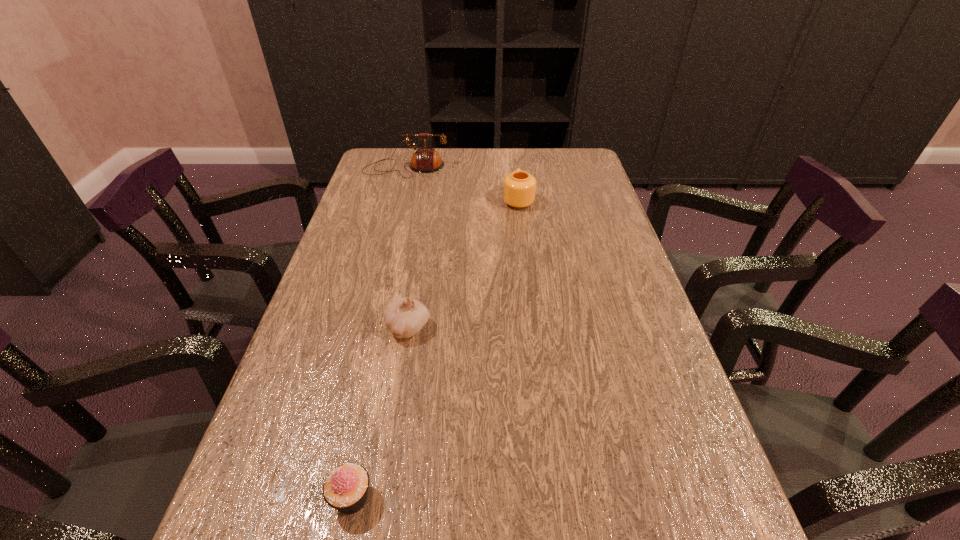
This screenshot has height=540, width=960. I want to click on blank region between the third farthest object and the nearest object, so click(x=380, y=413).

The height and width of the screenshot is (540, 960). Identify the location of vacant region between the second nearest object and the mug. (463, 264).

The height and width of the screenshot is (540, 960). I want to click on empty location between the garlic and the cupcake, so click(x=380, y=413).

Where is `vacant point located between the rightmost object and the garlic`? vacant point located between the rightmost object and the garlic is located at coordinates (463, 264).

The width and height of the screenshot is (960, 540). In order to click on vacant space that is in between the mug and the garlic in this screenshot , I will do `click(463, 264)`.

At what (x,y) coordinates should I click in order to perform the action: click on unoccupied position between the nearest object and the rightmost object. Please return your answer as a coordinate pair (x, y). This screenshot has height=540, width=960. Looking at the image, I should click on (435, 349).

Image resolution: width=960 pixels, height=540 pixels. I want to click on free area in between the third farthest object and the tallest object, so click(x=407, y=248).

Locate an element on the screen. free space between the farthest object and the cupcake is located at coordinates (379, 333).

Find the location of `vacant area that lies between the cupcake and the telephone`. vacant area that lies between the cupcake and the telephone is located at coordinates (379, 333).

Locate an element on the screen. Image resolution: width=960 pixels, height=540 pixels. vacant area that lies between the farthest object and the garlic is located at coordinates (407, 248).